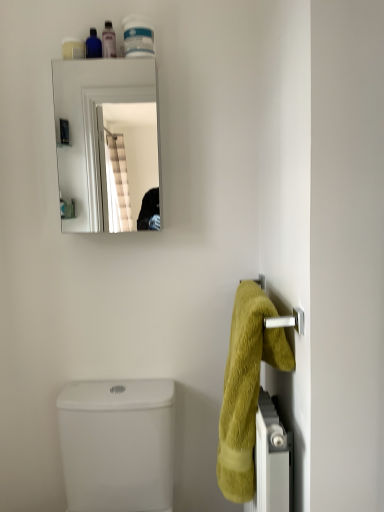
Question: Is there a large distance between white glossy container at upper center, which is the first toiletry from right to left, and translucent plastic bottle at upper center, the 2th toiletry from the right?

Choices:
 (A) no
 (B) yes

Answer: (A)

Question: From a real-world perspective, is white glossy container at upper center, placed as the 4th toiletry when sorted from left to right, physically above translucent plastic bottle at upper center, the 2th toiletry from the right?

Choices:
 (A) yes
 (B) no

Answer: (B)

Question: Is the depth of white glossy container at upper center, which is the first toiletry from right to left, greater than that of translucent plastic bottle at upper center, the 3th toiletry viewed from the left?

Choices:
 (A) no
 (B) yes

Answer: (A)

Question: Can you confirm if white glossy container at upper center, placed as the 4th toiletry when sorted from left to right, is bigger than translucent plastic bottle at upper center, the 2th toiletry from the right?

Choices:
 (A) no
 (B) yes

Answer: (B)

Question: From the image's perspective, is white glossy container at upper center, which is the first toiletry from right to left, located above translucent plastic bottle at upper center, the 2th toiletry from the right?

Choices:
 (A) no
 (B) yes

Answer: (A)

Question: From a real-world perspective, is white glossy container at upper center, which is the first toiletry from right to left, located beneath translucent plastic bottle at upper center, the 3th toiletry viewed from the left?

Choices:
 (A) no
 (B) yes

Answer: (B)

Question: Can you confirm if matte blue bottle at upper left, marked as the 2th toiletry in a left-to-right arrangement, is wider than soft yellow towel at right?

Choices:
 (A) no
 (B) yes

Answer: (A)

Question: Is there a large distance between matte blue bottle at upper left, marked as the 2th toiletry in a left-to-right arrangement, and soft yellow towel at right?

Choices:
 (A) yes
 (B) no

Answer: (A)

Question: Can you confirm if matte blue bottle at upper left, the third toiletry viewed from the right, is positioned to the left of soft yellow towel at right?

Choices:
 (A) yes
 (B) no

Answer: (A)

Question: Is matte blue bottle at upper left, marked as the 2th toiletry in a left-to-right arrangement, next to soft yellow towel at right and touching it?

Choices:
 (A) yes
 (B) no

Answer: (B)

Question: Does matte blue bottle at upper left, marked as the 2th toiletry in a left-to-right arrangement, appear on the right side of soft yellow towel at right?

Choices:
 (A) yes
 (B) no

Answer: (B)

Question: Can you confirm if matte blue bottle at upper left, the third toiletry viewed from the right, is bigger than soft yellow towel at right?

Choices:
 (A) yes
 (B) no

Answer: (B)

Question: From the image's perspective, does white glossy container at upper center, placed as the 4th toiletry when sorted from left to right, appear higher than soft yellow towel at right?

Choices:
 (A) yes
 (B) no

Answer: (A)